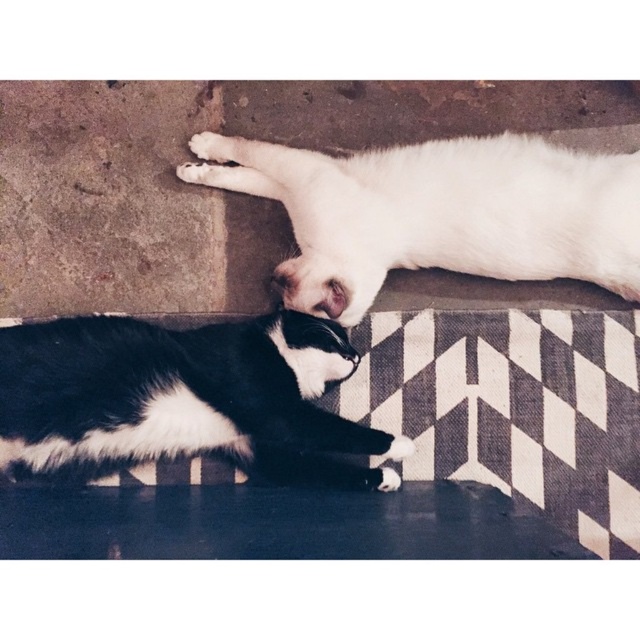
You are a photographer trying to capture both the white fluffy cat at upper center and the white fur paw at upper center in a single shot. Based on their sizes, which one would require more space in the frame?

The white fluffy cat at upper center requires more space in the frame because it is bigger than the white fur paw at upper center.

Please provide the coordinates of the white fluffy cat at upper center in the image. The coordinates should be in the format of a point with two decimal places separated by a comma. The answer should not contain any other information except the coordinates.

(440, 214)

You are a photographer trying to capture a closeup shot of the black and white fur cat at lower left without including the white fluffy cat at upper center in the frame. Based on their positions, is this possible?

The white fluffy cat at upper center is above the black and white fur cat at lower left, so it is possible to position the camera below the white fluffy cat at upper center to capture the black and white fur cat at lower left without including the white fluffy cat at upper center in the frame.